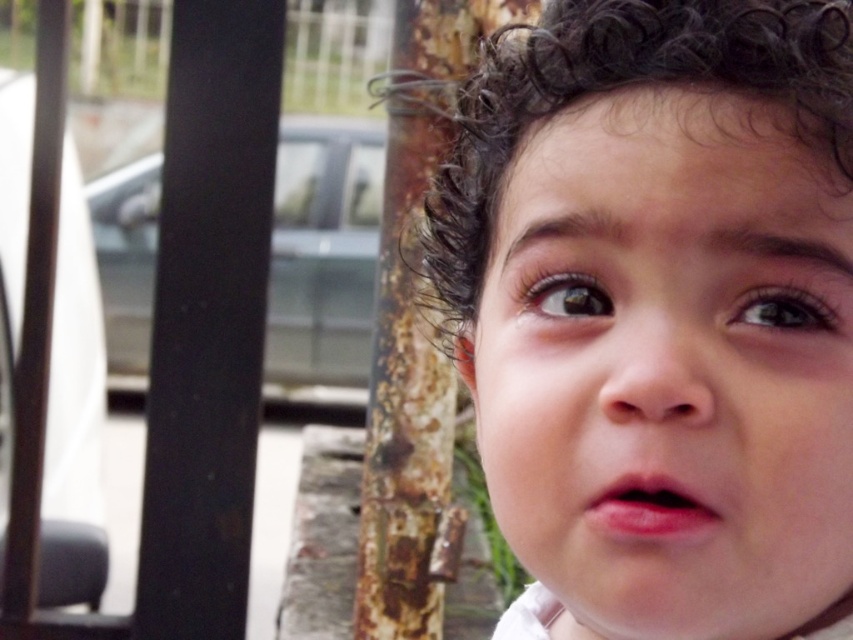
You are a photographer adjusting the focus on your camera. You notice the dark curly hair at center and the brown glossy eye at upper right. Which object should you focus on first to ensure both are in focus, considering their positions?

The dark curly hair at center is closer to the viewer than the brown glossy eye at upper right. To ensure both are in focus, focus on the dark curly hair at center first, as it is the closer object.

Based on the scene description, which object is positioned higher in the image? The smooth skin face at center or the brown glossy eye at upper right?

The brown glossy eye at upper right is positioned higher in the image since the smooth skin face at center is located below it.

Looking at the scene, which object is positioned to the left of the other between the smooth skin face at center and the brown glossy eye at upper right?

The smooth skin face at center is positioned to the left of the brown glossy eye at upper right.